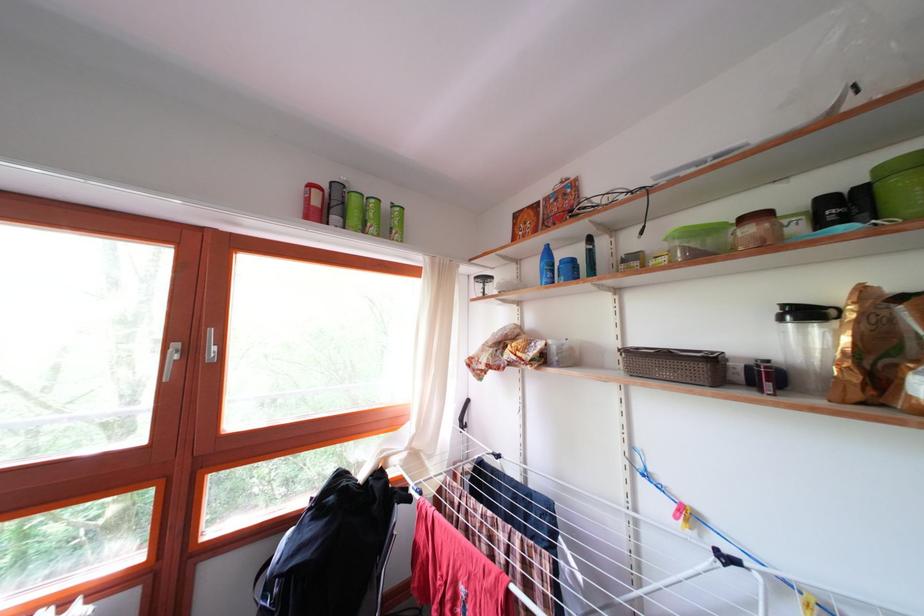
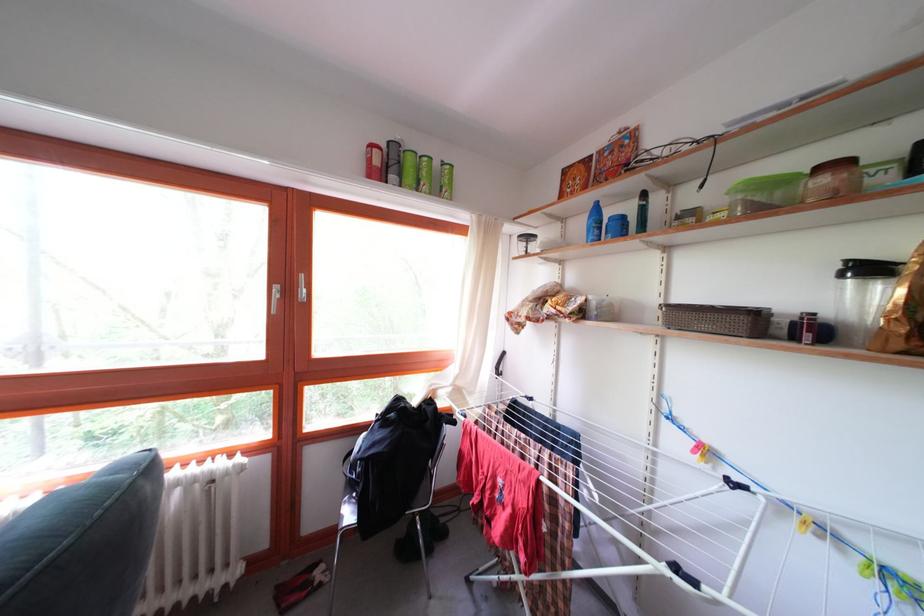
In the second image, find the point that corresponds to [373,229] in the first image.

(428, 187)